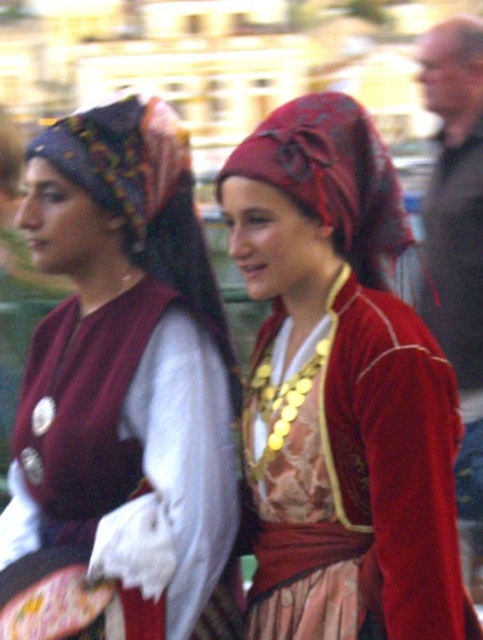
You are a photographer standing at a certain distance from the two individuals in the image. You want to take a closeup shot of the point at coordinates point (411, 410). Given that your camera can focus up to 60 meters, will you be able to capture the point clearly?

The distance of point (411, 410) from camera is 58.22 meters, which is within the camera focus range of 60 meters. Therefore, you can capture the point clearly.